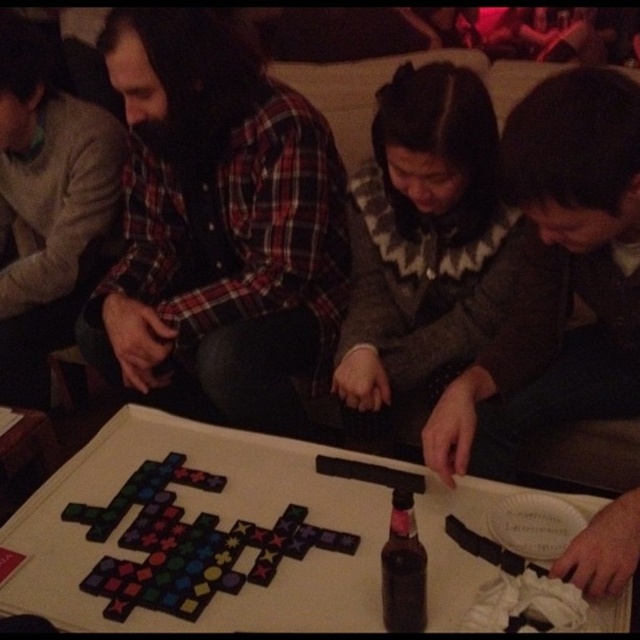
Question: Is plaid flannel shirt at left further to camera compared to dark glass bottle at center?

Choices:
 (A) no
 (B) yes

Answer: (B)

Question: Which object is the farthest from the dark glass bottle at center?

Choices:
 (A) white matte table at center
 (B) dark brown leather jacket at lower right
 (C) multicolored plastic game pieces at center
 (D) plaid flannel shirt at center

Answer: (D)

Question: Which object is the closest to the white matte table at center?

Choices:
 (A) dark brown leather jacket at lower right
 (B) multicolored plastic game pieces at center

Answer: (B)

Question: Is white matte table at center thinner than dark glass bottle at center?

Choices:
 (A) no
 (B) yes

Answer: (A)

Question: Does plaid flannel shirt at left have a larger size compared to multicolored plastic game pieces at center?

Choices:
 (A) no
 (B) yes

Answer: (B)

Question: Among these objects, which one is nearest to the camera?

Choices:
 (A) plaid flannel shirt at center
 (B) multicolored plastic game pieces at center
 (C) plaid flannel shirt at left

Answer: (B)